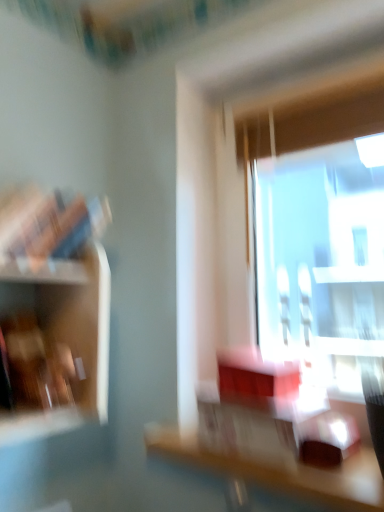
Question: Which is correct: wooden shelf at left is inside wooden table at center, or outside of it?

Choices:
 (A) outside
 (B) inside

Answer: (A)

Question: Is point (39, 320) positioned closer to the camera than point (322, 488)?

Choices:
 (A) closer
 (B) farther

Answer: (B)

Question: From a real-world perspective, relative to wooden table at center, is wooden shelf at left vertically above or below?

Choices:
 (A) below
 (B) above

Answer: (B)

Question: Based on their sizes in the image, would you say wooden table at center is bigger or smaller than wooden shelf at left?

Choices:
 (A) big
 (B) small

Answer: (B)

Question: From their relative heights in the image, would you say wooden table at center is taller or shorter than wooden shelf at left?

Choices:
 (A) short
 (B) tall

Answer: (A)

Question: Which is correct: wooden table at center is inside wooden shelf at left, or outside of it?

Choices:
 (A) outside
 (B) inside

Answer: (A)

Question: In the image, is wooden table at center positioned in front of or behind wooden shelf at left?

Choices:
 (A) front
 (B) behind

Answer: (A)